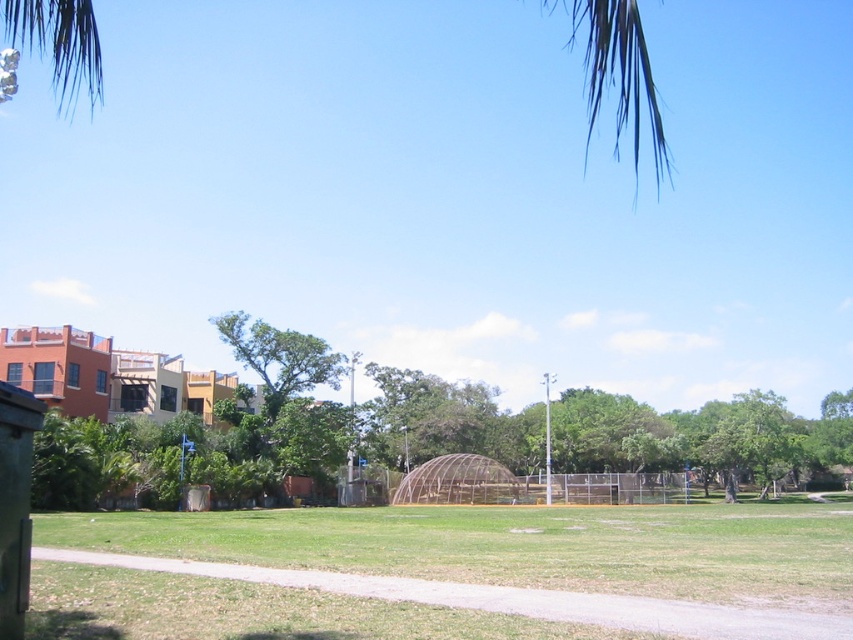
Question: Observing the image, what is the correct spatial positioning of green grass at center in reference to green leafy palm tree at upper left?

Choices:
 (A) left
 (B) right

Answer: (B)

Question: Can you confirm if green grass at center is wider than green leafy palm tree at upper left?

Choices:
 (A) yes
 (B) no

Answer: (B)

Question: Which object is closer to the camera taking this photo?

Choices:
 (A) green leafy palm tree at upper left
 (B) green grass at center

Answer: (A)

Question: Can you confirm if green grass at center is bigger than green leafy palm tree at upper left?

Choices:
 (A) no
 (B) yes

Answer: (A)